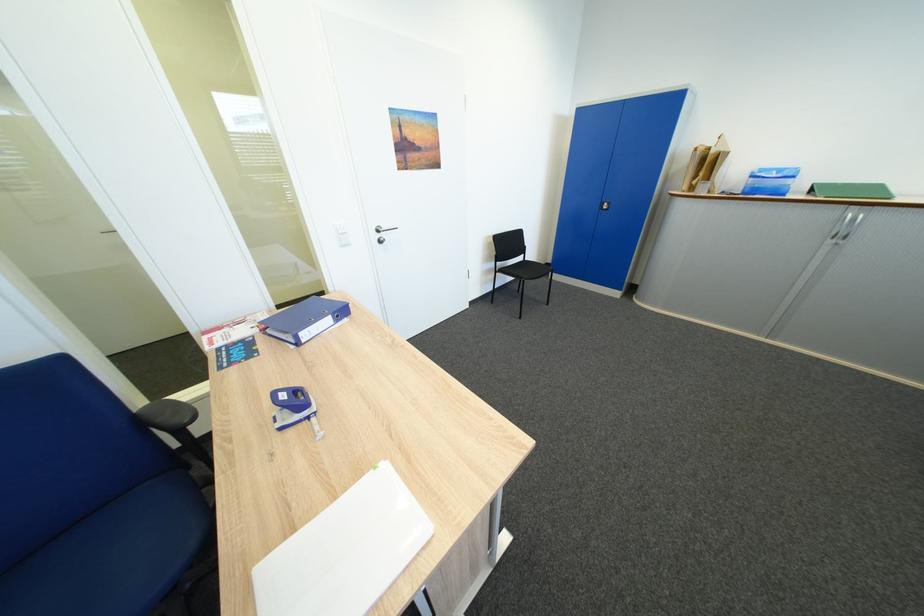
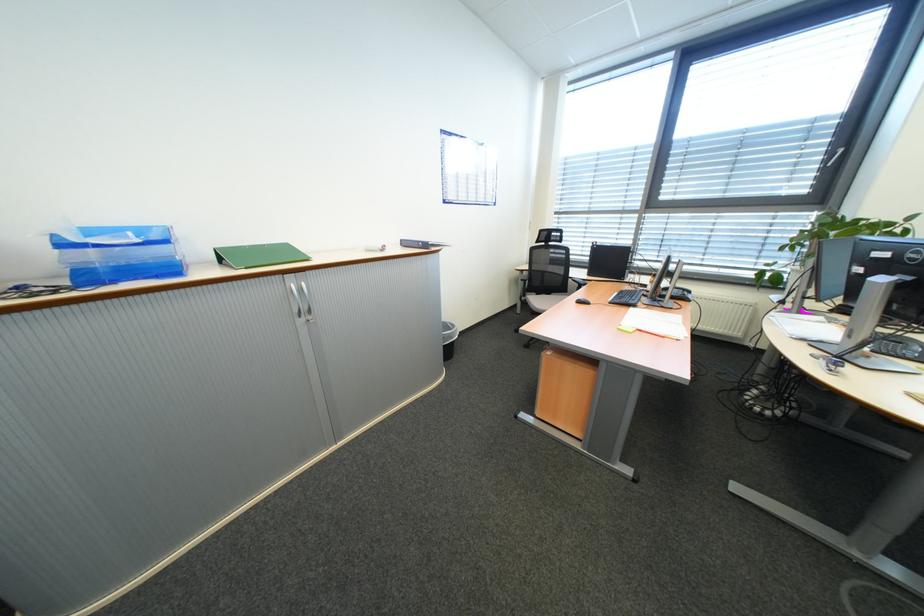
The point at (774, 179) is marked in the first image. Where is the corresponding point in the second image?

(107, 246)